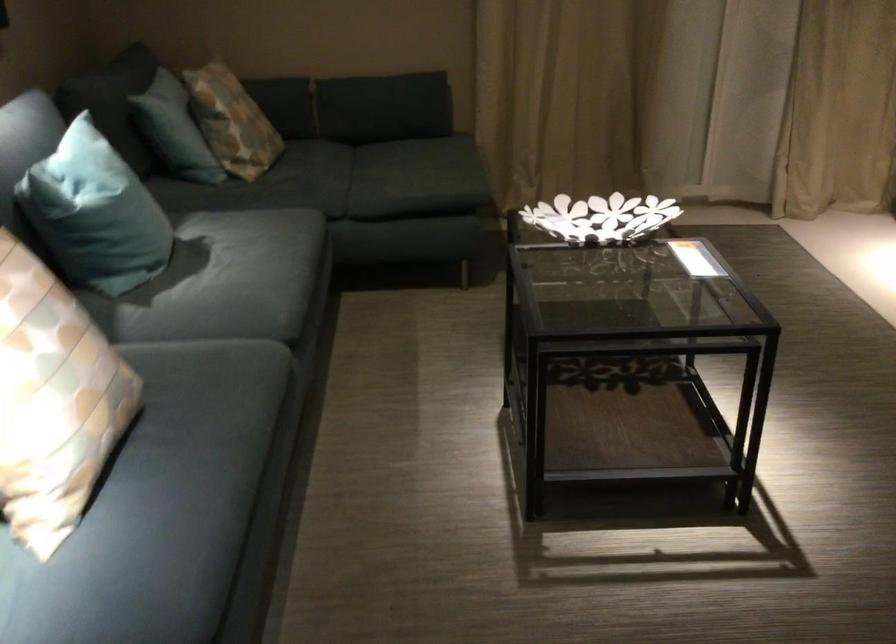
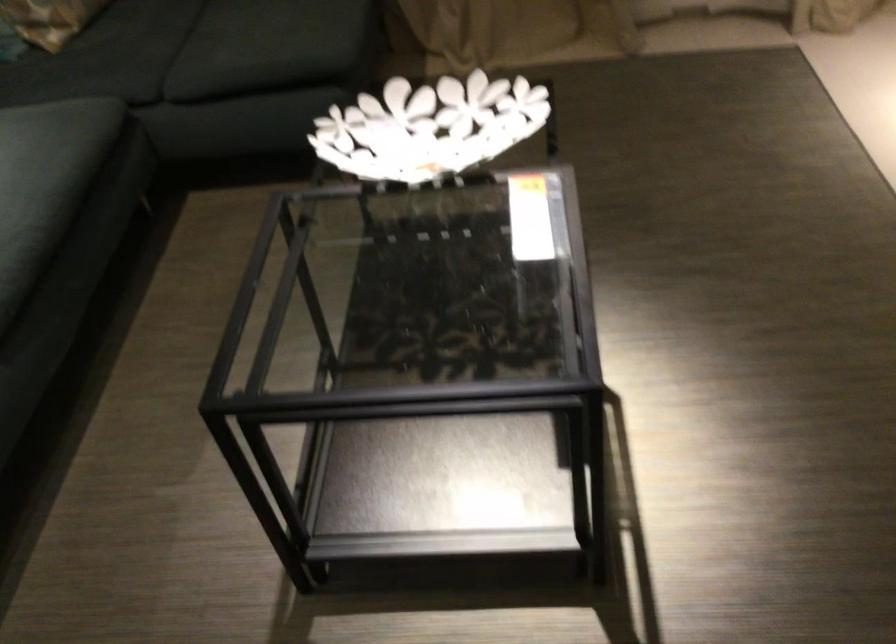
Find the pixel in the second image that matches pixel 586 219 in the first image.

(429, 127)